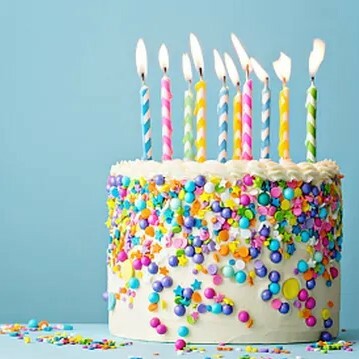
Locate an element on the screen. The image size is (359, 359). candles is located at coordinates (143, 103), (166, 101), (188, 103), (200, 103), (225, 106), (240, 108), (246, 104), (265, 109), (284, 110), (310, 113).